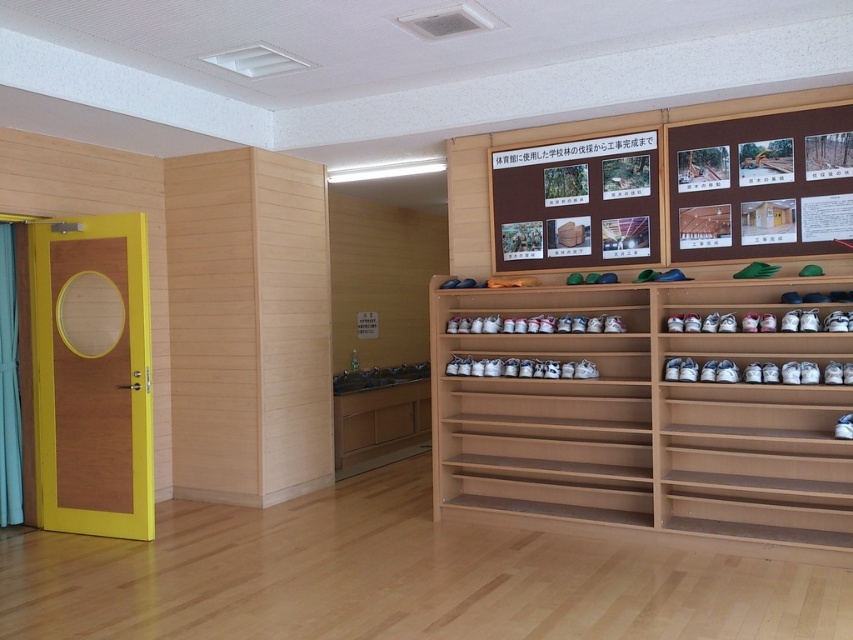
Which is behind, point (589, 257) or point (585, 160)?

Positioned behind is point (589, 257).

The image size is (853, 640). I want to click on brown wooden bulletin board at upper center, so click(671, 188).

Which is behind, point (618, 353) or point (492, 173)?

The point (492, 173) is more distant.

Is wooden shoe rack at center to the right of wooden bulletin board at upper center from the viewer's perspective?

Yes, wooden shoe rack at center is to the right of wooden bulletin board at upper center.

Between point (589, 429) and point (505, 170), which one is positioned in front?

Point (589, 429) is in front.

This screenshot has width=853, height=640. Identify the location of wooden shoe rack at center. (643, 420).

Is wooden shoe rack at center thinner than brown wooden bulletin board at upper center?

No, wooden shoe rack at center is not thinner than brown wooden bulletin board at upper center.

Who is shorter, wooden shoe rack at center or brown wooden bulletin board at upper center?

With less height is brown wooden bulletin board at upper center.

Locate an element on the screen. wooden shoe rack at center is located at coordinates (643, 420).

Where is `wooden shoe rack at center`? wooden shoe rack at center is located at coordinates (643, 420).